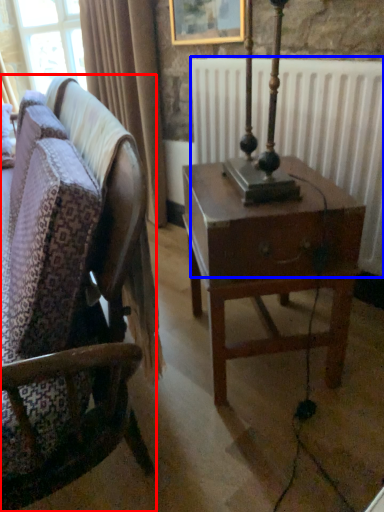
Question: Which point is closer to the camera, chair (highlighted by a red box) or radiator (highlighted by a blue box)?

Choices:
 (A) chair
 (B) radiator

Answer: (A)